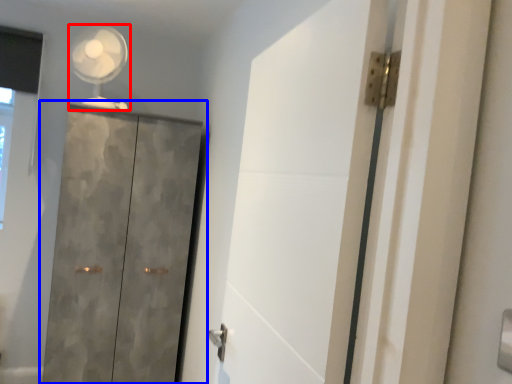
Question: Among these objects, which one is nearest to the camera, mechanical fan (highlighted by a red box) or cupboard (highlighted by a blue box)?

Choices:
 (A) mechanical fan
 (B) cupboard

Answer: (B)